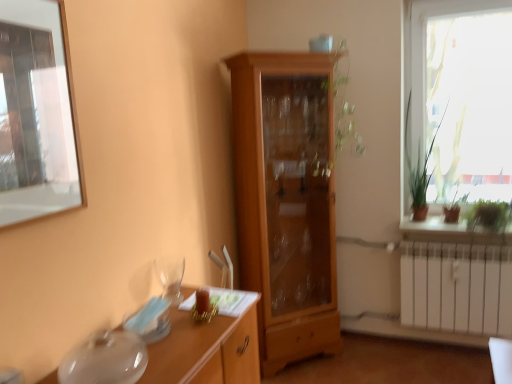
Question: From a real-world perspective, is transparent glass desk at lower left positioned under transparent glass window screen at upper left based on gravity?

Choices:
 (A) no
 (B) yes

Answer: (B)

Question: Is transparent glass desk at lower left shorter than transparent glass window screen at upper left?

Choices:
 (A) yes
 (B) no

Answer: (A)

Question: Is transparent glass desk at lower left positioned with its back to transparent glass window screen at upper left?

Choices:
 (A) no
 (B) yes

Answer: (A)

Question: From the image's perspective, does transparent glass desk at lower left appear lower than transparent glass window screen at upper left?

Choices:
 (A) no
 (B) yes

Answer: (B)

Question: Are transparent glass desk at lower left and transparent glass window screen at upper left making contact?

Choices:
 (A) no
 (B) yes

Answer: (A)

Question: Is the position of transparent glass desk at lower left less distant than that of transparent glass window screen at upper left?

Choices:
 (A) no
 (B) yes

Answer: (A)

Question: Can you confirm if green leafy plant at right, which is counted as the first plant, starting from the left, is bigger than light brown wood cabinet at center?

Choices:
 (A) no
 (B) yes

Answer: (A)

Question: Does green leafy plant at right, arranged as the second plant when viewed from the right, touch light brown wood cabinet at center?

Choices:
 (A) no
 (B) yes

Answer: (A)

Question: From a real-world perspective, does green leafy plant at right, arranged as the second plant when viewed from the right, stand above light brown wood cabinet at center?

Choices:
 (A) no
 (B) yes

Answer: (B)

Question: Are green leafy plant at right, which is counted as the first plant, starting from the left, and light brown wood cabinet at center located far from each other?

Choices:
 (A) no
 (B) yes

Answer: (A)

Question: Is green leafy plant at right, arranged as the second plant when viewed from the right, oriented towards light brown wood cabinet at center?

Choices:
 (A) yes
 (B) no

Answer: (B)

Question: Does green leafy plant at right, arranged as the second plant when viewed from the right, have a greater height compared to light brown wood cabinet at center?

Choices:
 (A) yes
 (B) no

Answer: (B)

Question: Are green leafy plant at right, the second plant from the left, and green matte plant at right far apart?

Choices:
 (A) yes
 (B) no

Answer: (B)